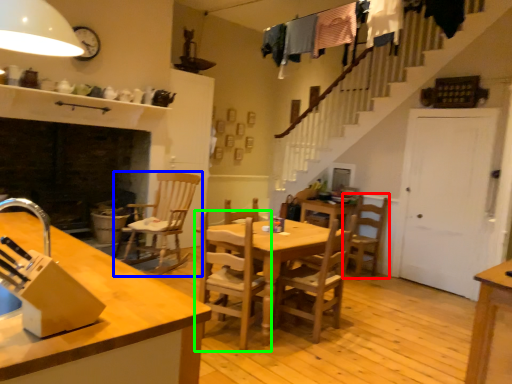
Question: Estimate the real-world distances between objects in this image. Which object is farther from chair (highlighted by a red box), chair (highlighted by a blue box) or chair (highlighted by a green box)?

Choices:
 (A) chair
 (B) chair

Answer: (A)